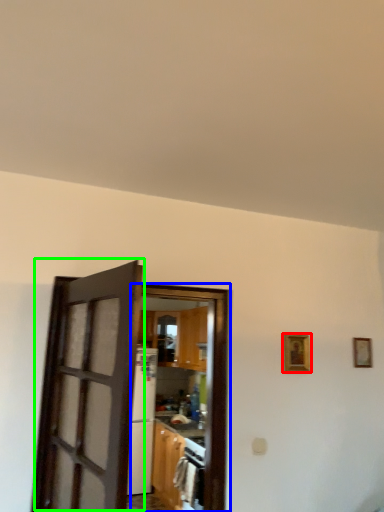
Question: Based on their relative distances, which object is farther from picture frame (highlighted by a red box)? Choose from door (highlighted by a blue box) and door (highlighted by a green box).

Choices:
 (A) door
 (B) door

Answer: (B)